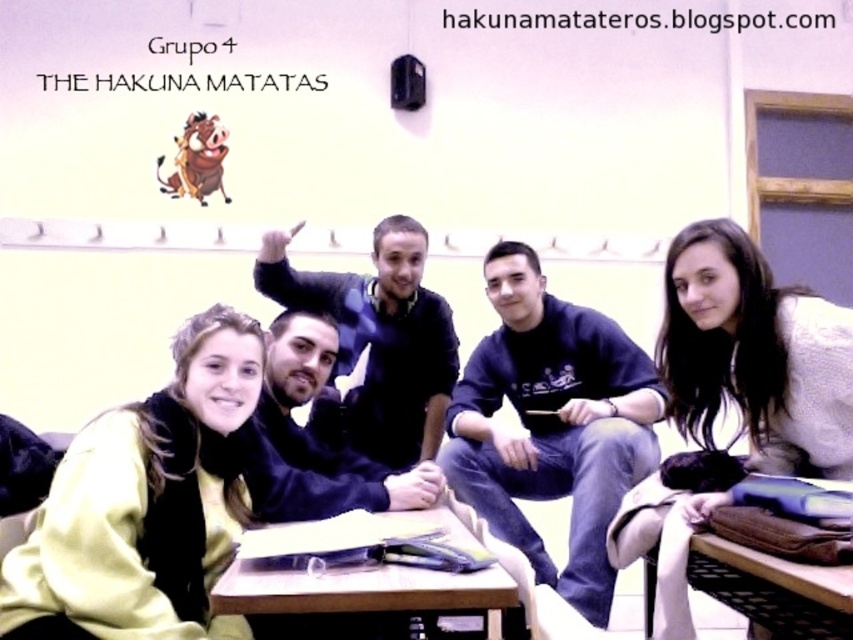
Question: Where is dark blue sweatshirt at center located in relation to black matte jacket at center in the image?

Choices:
 (A) left
 (B) right

Answer: (B)

Question: Considering the relative positions of black matte jacket at center and wooden table at center in the image provided, where is black matte jacket at center located with respect to wooden table at center?

Choices:
 (A) above
 (B) below

Answer: (A)

Question: Estimate the real-world distances between objects in this image. Which object is closer to the black matte shirt at center?

Choices:
 (A) black matte jacket at center
 (B) wooden table at center
 (C) dark blue sweatshirt at center

Answer: (C)

Question: Which object is farther from the camera taking this photo?

Choices:
 (A) black matte shirt at center
 (B) black matte jacket at center
 (C) dark blue sweatshirt at center

Answer: (A)

Question: Is black matte shirt at center bigger than black matte jacket at center?

Choices:
 (A) yes
 (B) no

Answer: (A)

Question: Among these objects, which one is farthest from the camera?

Choices:
 (A) black matte shirt at center
 (B) wooden table at center
 (C) black matte jacket at center

Answer: (A)